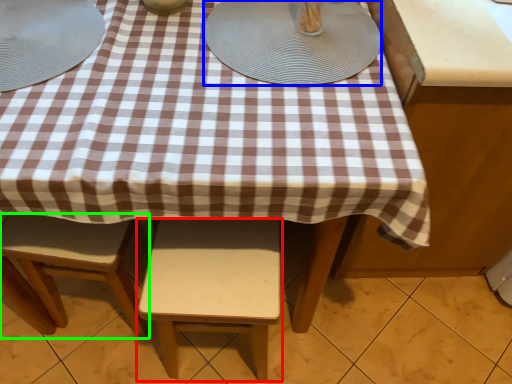
Question: Which object is the farthest from stool (highlighted by a red box)? Choose among these: platter (highlighted by a blue box) or stool (highlighted by a green box).

Choices:
 (A) platter
 (B) stool

Answer: (A)